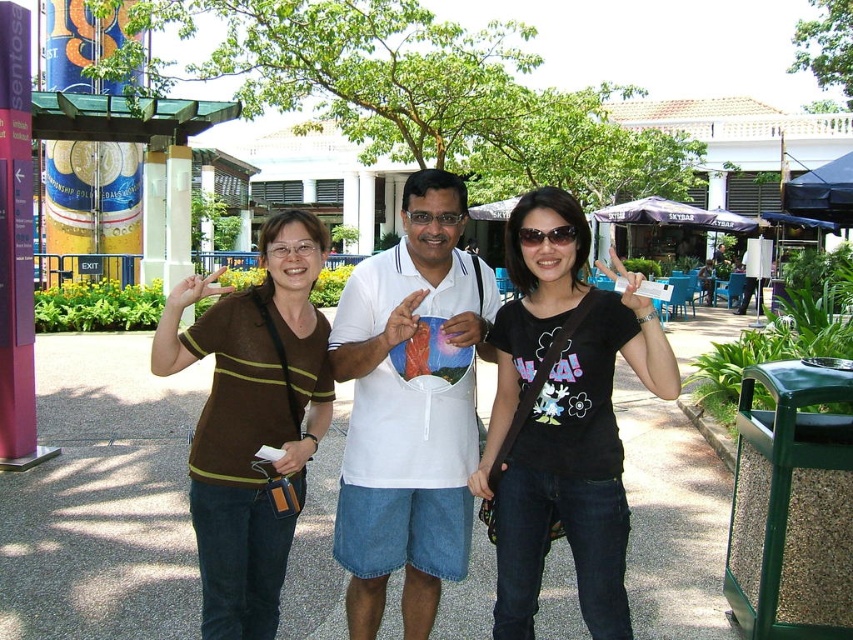
What do you see at coordinates (387, 321) in the screenshot? I see `brown striped shirt at left` at bounding box center [387, 321].

Between point (492, 426) and point (439, 212), which one is positioned in front?

Point (439, 212) is more forward.

The width and height of the screenshot is (853, 640). I want to click on brown striped shirt at left, so click(x=387, y=321).

Does matte brown sweater at center have a lesser height compared to black plastic sunglasses at center?

Incorrect, matte brown sweater at center's height does not fall short of black plastic sunglasses at center's.

Is matte brown sweater at center closer to the viewer compared to black plastic sunglasses at center?

Yes, it is in front of black plastic sunglasses at center.

The image size is (853, 640). What do you see at coordinates (252, 420) in the screenshot? I see `matte brown sweater at center` at bounding box center [252, 420].

Where is `matte brown sweater at center`? This screenshot has width=853, height=640. matte brown sweater at center is located at coordinates (252, 420).

Between brown striped shirt at left and matte brown sweater at center, which one appears on the left side from the viewer's perspective?

Positioned to the left is matte brown sweater at center.

Can you confirm if brown striped shirt at left is positioned above matte brown sweater at center?

Yes, brown striped shirt at left is above matte brown sweater at center.

Is point (364, 611) positioned after point (247, 627)?

That is True.

Find the location of a particular element. The height and width of the screenshot is (640, 853). brown striped shirt at left is located at coordinates (387, 321).